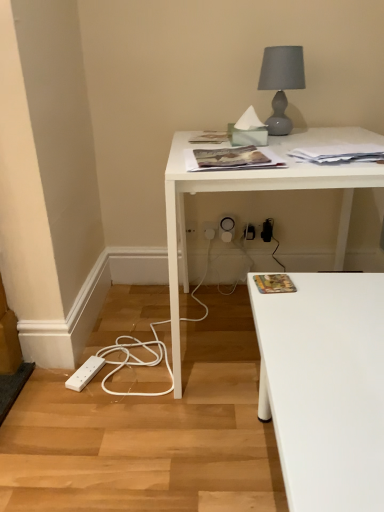
Question: From the image's perspective, relative to printed paper magazine at lower right, arranged as the 4th magazine when viewed from the top, is matte gray glass table lamp at upper right above or below?

Choices:
 (A) above
 (B) below

Answer: (A)

Question: Considering the positions of matte gray glass table lamp at upper right and printed paper magazine at lower right, the 4th magazine from the back, in the image, is matte gray glass table lamp at upper right wider or thinner than printed paper magazine at lower right, the 4th magazine from the back,?

Choices:
 (A) thin
 (B) wide

Answer: (B)

Question: Which of these objects is positioned closest to the matte paper magazine at center, which is the 1th magazine in top-to-bottom order?

Choices:
 (A) white plastic electric outlet at lower center, the second electric outlet positioned from the left
 (B) white plastic electric outlet at lower center, placed as the 2th electric outlet when sorted from right to left
 (C) printed paper magazine at lower right, the 1th magazine when ordered from bottom to top
 (D) white glossy desk at center
 (E) matte gray glass table lamp at upper right

Answer: (E)

Question: Considering the real-world distances, which object is farthest from the white plastic electric outlet at lower center, placed as the 2th electric outlet when sorted from right to left?

Choices:
 (A) matte gray glass table lamp at upper right
 (B) matte paper magazine at center, the first magazine from the back
 (C) white paper at upper right, placed as the 3th magazine when sorted from top to bottom
 (D) printed paper magazine at upper center, the third magazine viewed from the back
 (E) white plastic electric outlet at lower center, the second electric outlet positioned from the left

Answer: (C)